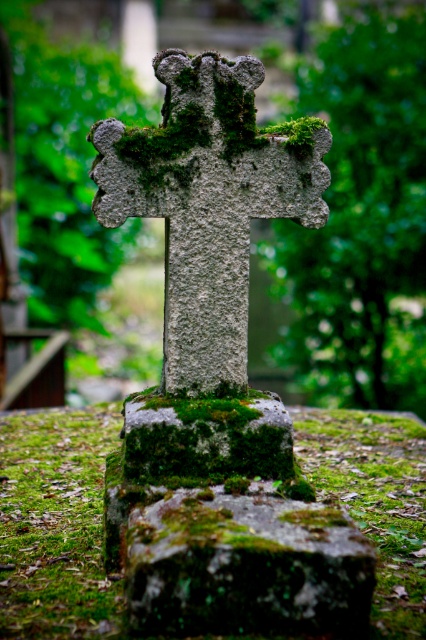
You are standing in front of the weathered stone cross in the cemetery. You notice two points marked on the cross. The first point is at coordinate point (215, 113) and the second is at point (259, 509). If you were to touch both points with your hand, which point would you reach first?

Point (215, 113) is further to the camera than point (259, 509), so you would reach point (215, 113) first because it is closer to you.

You are a gardener planning to remove the moss from the mossy stone cross at center and the green mossy stone at center. Which object should you treat first if you want to start with the one that is higher up?

The mossy stone cross at center is positioned over green mossy stone at center, so you should treat the mossy stone cross at center first since it is higher up.